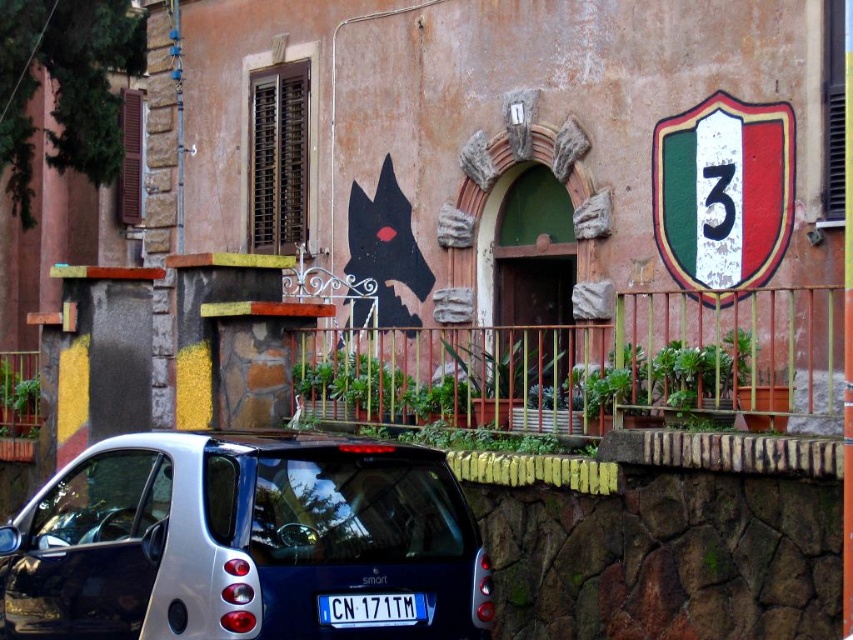
Measure the distance between painted metal shield at upper right and camera.

painted metal shield at upper right is 57.03 feet from camera.

Can you confirm if painted metal shield at upper right is positioned below white plastic license plate at center?

Incorrect, painted metal shield at upper right is not positioned below white plastic license plate at center.

Is point (708, 200) positioned before point (358, 596)?

No, (708, 200) is behind (358, 596).

I want to click on painted metal shield at upper right, so click(723, 195).

Does point (254, 508) lie behind point (726, 145)?

No, it is in front of (726, 145).

Who is shorter, metallic blue car at lower left or painted metal shield at upper right?

metallic blue car at lower left

Is point (347, 634) farther from camera compared to point (746, 253)?

No, (347, 634) is closer to viewer.

Find the location of `metallic blue car at lower left`. metallic blue car at lower left is located at coordinates (241, 540).

Which is in front, point (131, 516) or point (344, 596)?

Positioned in front is point (344, 596).

Is point (61, 612) positioned in front of point (328, 602)?

No, it is not.

Does point (196, 541) lie behind point (378, 600)?

No, (196, 541) is in front of (378, 600).

What are the coordinates of `metallic blue car at lower left` in the screenshot? It's located at (241, 540).